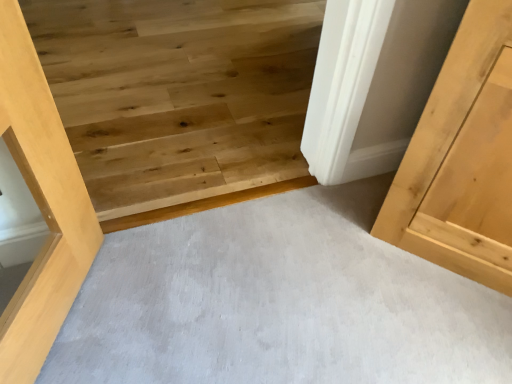
This screenshot has width=512, height=384. Describe the element at coordinates (178, 94) in the screenshot. I see `natural wood stairwell at center` at that location.

The image size is (512, 384). Identify the location of natural wood stairwell at center. (178, 94).

Based on the photo, what is the approximate height of natural wood stairwell at center?

It is 1.58 inches.

I want to click on natural wood stairwell at center, so click(178, 94).